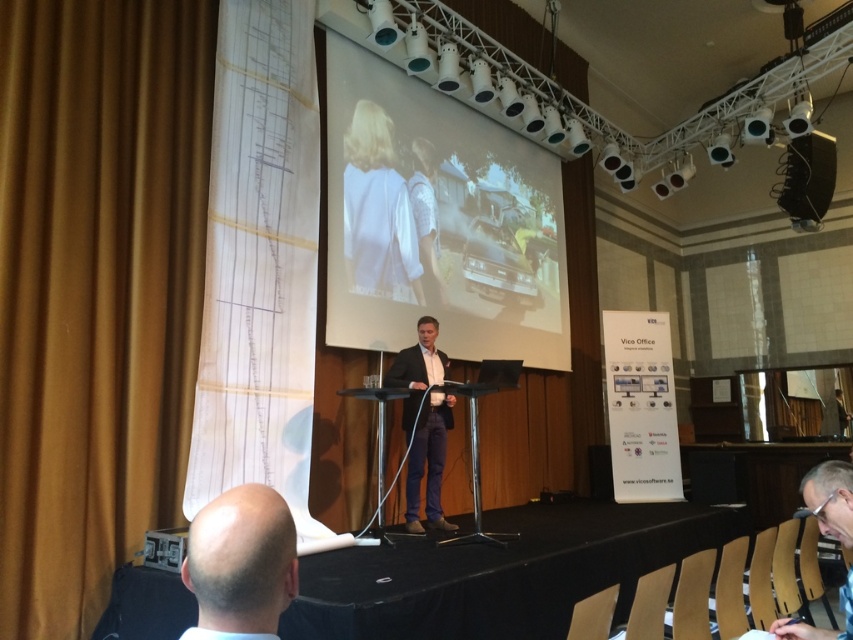
Question: Does bald head at lower left appear under white fabric at center?

Choices:
 (A) yes
 (B) no

Answer: (A)

Question: Which of the following is the closest to the observer?

Choices:
 (A) (851, 580)
 (B) (399, 355)
 (C) (357, 129)
 (D) (231, 593)

Answer: (D)

Question: Does dark suit at center appear over white cotton shirt at center?

Choices:
 (A) no
 (B) yes

Answer: (A)

Question: Which point is farther to the camera?

Choices:
 (A) clear plastic glasses at lower right
 (B) dark suit at center
 (C) white glossy projection screen at center
 (D) white cotton shirt at center

Answer: (D)

Question: Is dark suit at center bigger than clear plastic glasses at lower right?

Choices:
 (A) no
 (B) yes

Answer: (B)

Question: Which point is farther from the camera taking this photo?

Choices:
 (A) (374, 120)
 (B) (434, 429)

Answer: (A)